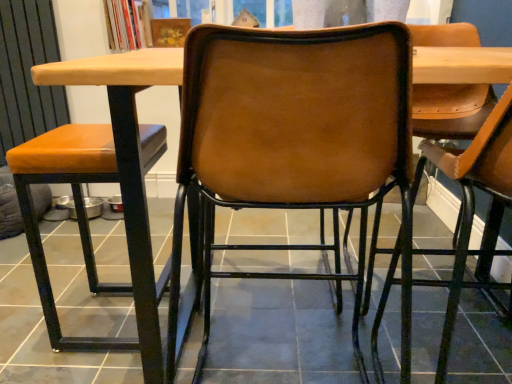
You are a GUI agent. You are given a task and a screenshot of the screen. Output one action in this format:
    pyautogui.click(x=<x>, y=<y>)
    Task: Click on the spots to the right of orange leather stool at left, the 3th chair viewed from the right
    The width and height of the screenshot is (512, 384).
    Given the screenshot: What is the action you would take?
    pyautogui.click(x=220, y=319)